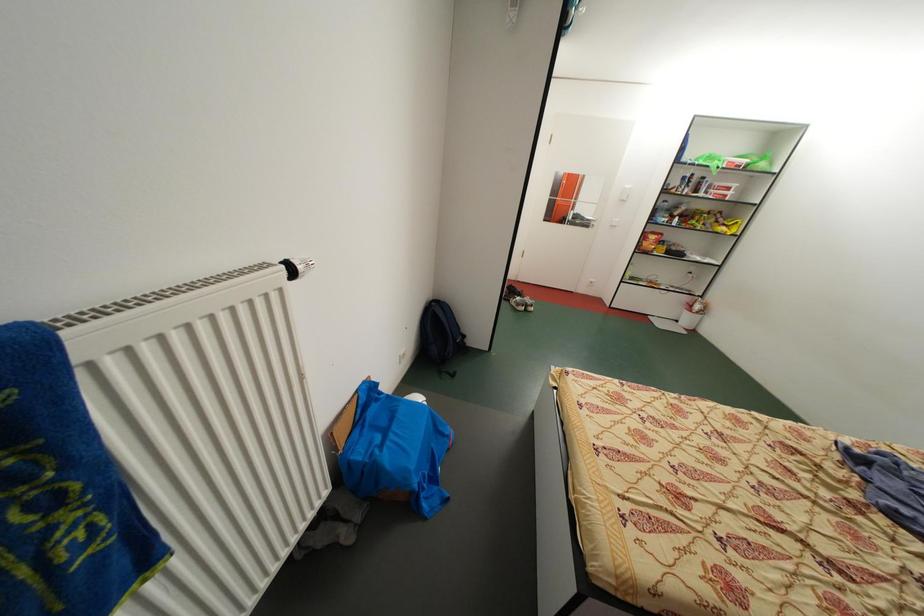
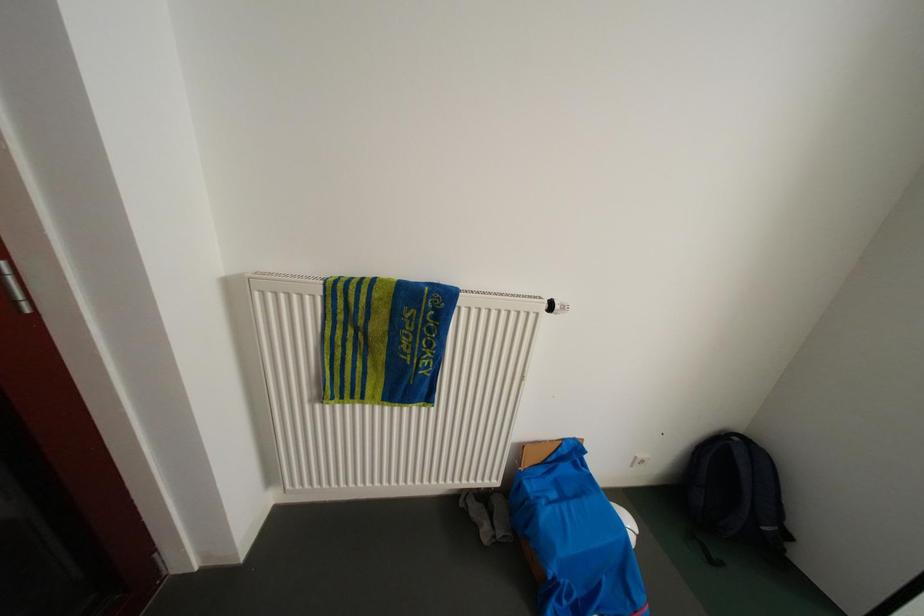
Question: The first image is from the beginning of the video and the second image is from the end. How did the camera likely rotate when shooting the video?

Choices:
 (A) Left
 (B) Right
 (C) Up
 (D) Down

Answer: (A)